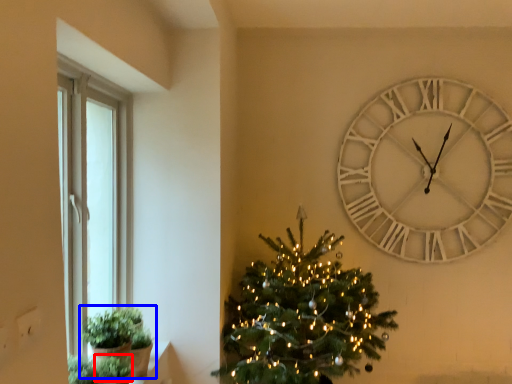
Question: Which point is closer to the camera, plant (highlighted by a red box) or houseplant (highlighted by a blue box)?

Choices:
 (A) plant
 (B) houseplant

Answer: (A)